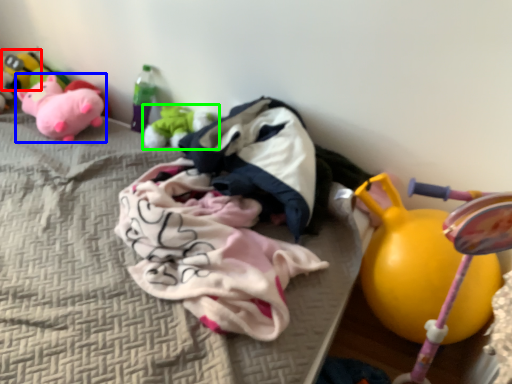
Question: Estimate the real-world distances between objects in this image. Which object is closer to toy (highlighted by a red box), toy (highlighted by a blue box) or toy (highlighted by a green box)?

Choices:
 (A) toy
 (B) toy

Answer: (A)